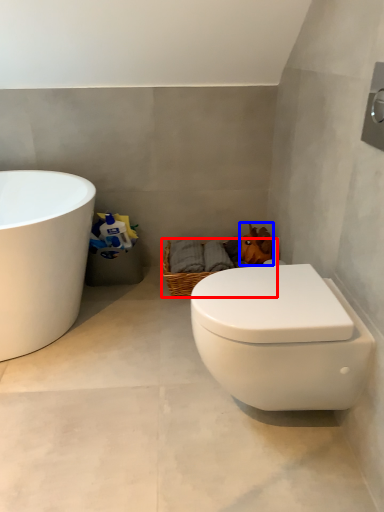
Question: Among these objects, which one is nearest to the camera, basket (highlighted by a red box) or animal (highlighted by a blue box)?

Choices:
 (A) basket
 (B) animal

Answer: (B)